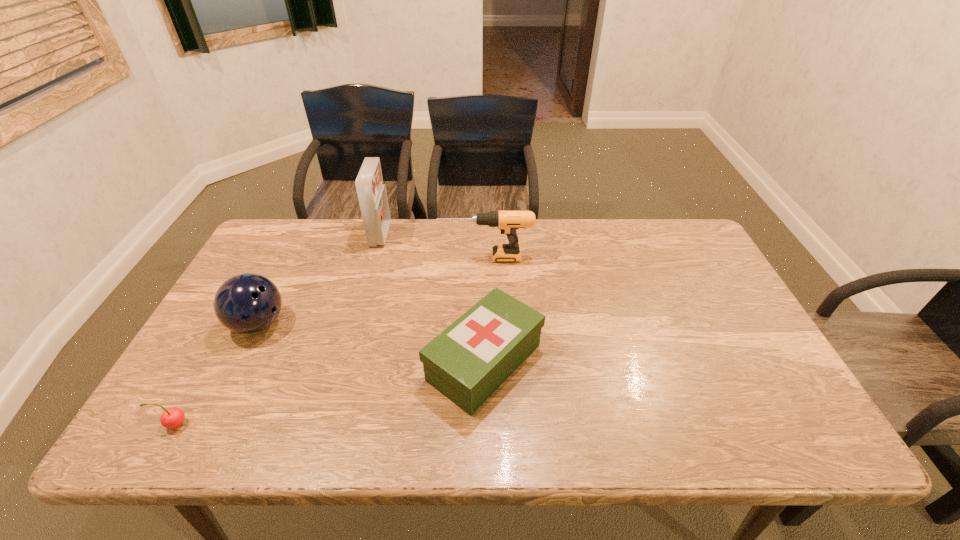
Find the location of a particular element. free spot located on the handle side of the drill is located at coordinates (345, 257).

Identify the location of vacant space situated 0.190m on the surface of the bowling ball near the finger holes. This screenshot has width=960, height=540. (358, 324).

Locate an element on the screen. free space located on the right of the second shortest object is located at coordinates (605, 362).

Where is `vacant region located 0.100m on the back of the shortest object`? The width and height of the screenshot is (960, 540). vacant region located 0.100m on the back of the shortest object is located at coordinates (201, 377).

Image resolution: width=960 pixels, height=540 pixels. I want to click on the first-aid kit that is at the far edge, so click(372, 195).

In order to click on drill that is positioned at the far edge in this screenshot , I will do `click(508, 222)`.

Find the location of `the first-aid kit that is at the near edge`. the first-aid kit that is at the near edge is located at coordinates (467, 362).

Where is `cherry that is positioned at the near edge`? This screenshot has width=960, height=540. cherry that is positioned at the near edge is located at coordinates click(x=171, y=418).

At what (x,y) coordinates should I click in order to perform the action: click on bowling ball that is at the left edge. Please return your answer as a coordinate pair (x, y). Looking at the image, I should click on (247, 303).

This screenshot has height=540, width=960. What are the coordinates of `cherry located in the left edge section of the desktop` in the screenshot? It's located at (171, 418).